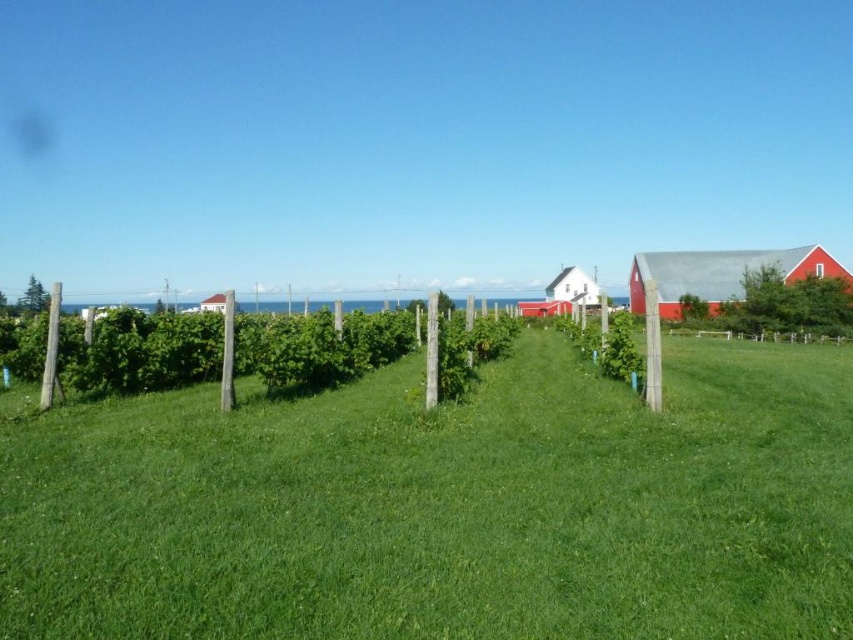
You are a gardener planning to water the green grassy at center and the green leafy hedge at center. Which one is located below the other?

The green grassy at center is positioned under the green leafy hedge at center, so the grassy area is below the hedge.

You are standing in the vineyard and want to take a photo of both the green grassy at center and the red matte barn at right. Which object should you focus on first to ensure both are in clear view?

You should focus on the green grassy at center first because it is closer to the viewer than the red matte barn at right, so adjusting focus starting from the closer object ensures both are in clear view.

In the scene shown: You are a farmer planning to paint both the red matte barn at right and the white matte barn at center. If you have enough paint for one barn, which barn should you choose to paint first based on their sizes?

The red matte barn at right is bigger than the white matte barn at center, so you should paint the red matte barn at right first since it requires more paint.